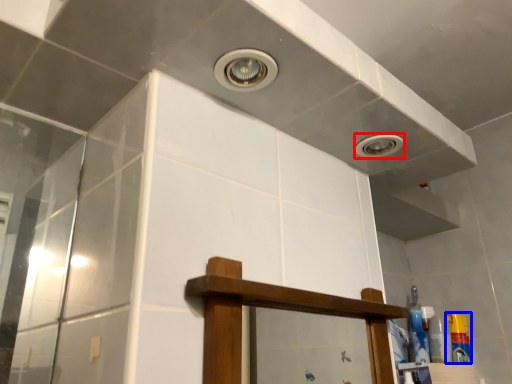
Question: Which point is further to the camera, droplight (highlighted by a red box) or toiletry (highlighted by a blue box)?

Choices:
 (A) droplight
 (B) toiletry

Answer: (B)